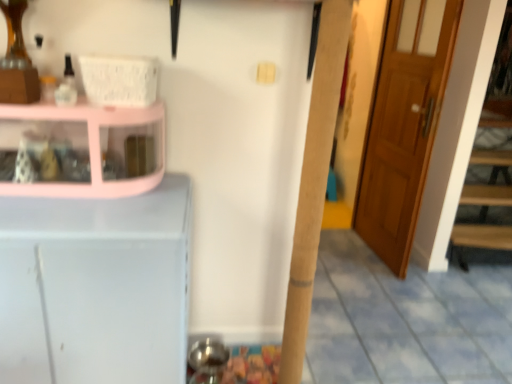
Question: From the image's perspective, is pink glossy cabinet at left located beneath white matte cabinet at left?

Choices:
 (A) no
 (B) yes

Answer: (A)

Question: Is pink glossy cabinet at left at the right side of white matte cabinet at left?

Choices:
 (A) yes
 (B) no

Answer: (A)

Question: Is pink glossy cabinet at left completely or partially outside of white matte cabinet at left?

Choices:
 (A) no
 (B) yes

Answer: (B)

Question: Considering the relative sizes of pink glossy cabinet at left and white matte cabinet at left in the image provided, is pink glossy cabinet at left shorter than white matte cabinet at left?

Choices:
 (A) yes
 (B) no

Answer: (A)

Question: Could you tell me if pink glossy cabinet at left is facing white matte cabinet at left?

Choices:
 (A) yes
 (B) no

Answer: (B)

Question: Is pink glossy cabinet at left bigger than white matte cabinet at left?

Choices:
 (A) yes
 (B) no

Answer: (B)

Question: From a real-world perspective, is pink glossy cabinet at left over wooden door at right?

Choices:
 (A) no
 (B) yes

Answer: (B)

Question: Is pink glossy cabinet at left thinner than wooden door at right?

Choices:
 (A) yes
 (B) no

Answer: (B)

Question: Is pink glossy cabinet at left surrounding wooden door at right?

Choices:
 (A) no
 (B) yes

Answer: (A)

Question: Is pink glossy cabinet at left outside wooden door at right?

Choices:
 (A) no
 (B) yes

Answer: (B)

Question: Can you confirm if pink glossy cabinet at left is wider than wooden door at right?

Choices:
 (A) no
 (B) yes

Answer: (B)

Question: From the image's perspective, is pink glossy cabinet at left under wooden door at right?

Choices:
 (A) no
 (B) yes

Answer: (B)

Question: Can you confirm if white matte cabinet at left is taller than pink glossy cabinet at left?

Choices:
 (A) no
 (B) yes

Answer: (B)